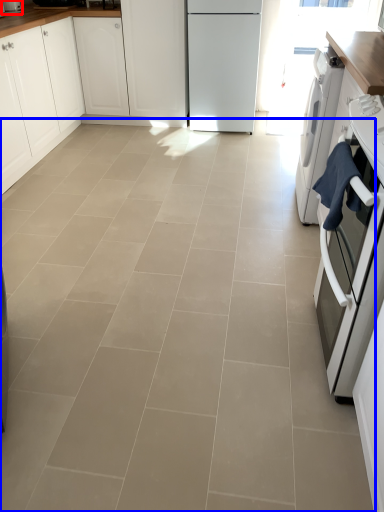
Question: Which point is closer to the camera, kitchen appliance (highlighted by a red box) or ceramic tile (highlighted by a blue box)?

Choices:
 (A) kitchen appliance
 (B) ceramic tile

Answer: (B)